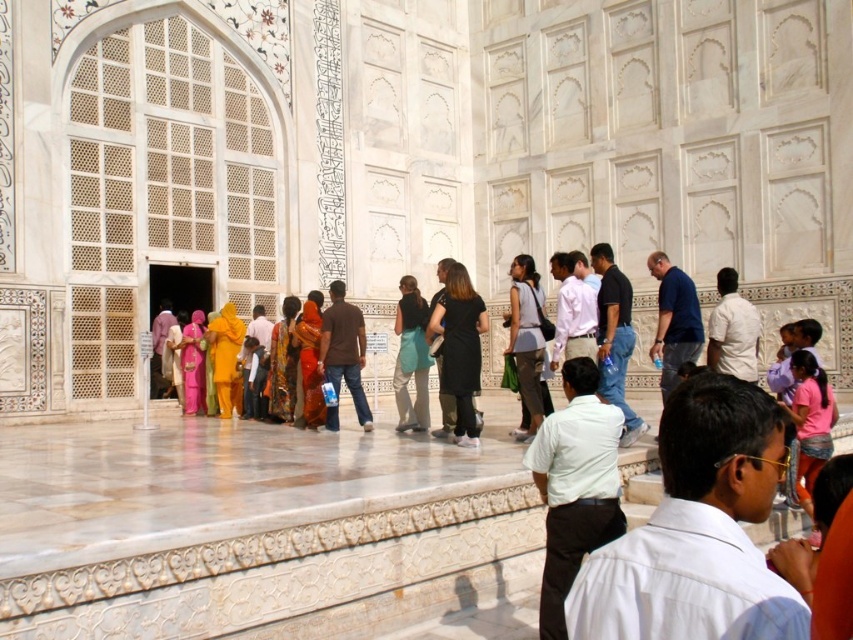
You are a photographer trying to capture a group photo of the tourists in front of the marble structure. You notice the black matte dress at center and the matte gray pants at center. To ensure both outfits are clearly visible in the photo, which outfit requires more space between the subjects to avoid overlapping?

The matte gray pants at center require more space between the subjects because their width is greater than the black matte dress at center.

You are a photographer positioned 20 meters away from the marble structure. You want to capture a clear photo of the black matte dress at center without including the marble structure in the frame. Is this possible given the distance?

The black matte dress at center is 23.44 meters away from the viewer. Since you are positioned 20 meters away from the marble structure, the dress is farther than the structure. To exclude the marble structure, you need to ensure the dress is not behind it. However, since the dress is at the center and the structure is behind, adjusting the camera angle might help, but the distance difference is only 3.44 meters. This might be challenging without moving closer or using a telephoto lens.

You are a photographer trying to capture a photo of the group. You notice the black matte dress at center and the pink cotton shirt at lower right. Which one is closer to your camera lens?

The black matte dress at center is closer to the camera lens because it is further to the viewer than the pink cotton shirt at lower right.